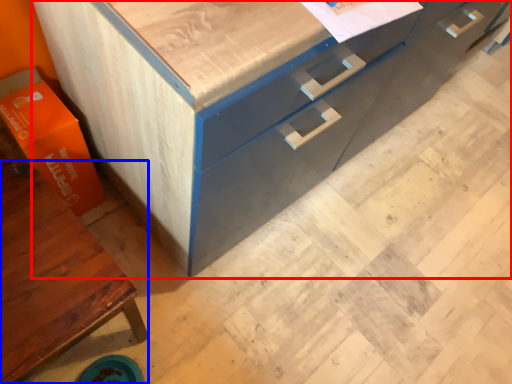
Question: Which object appears closest to the camera in this image, chest of drawers (highlighted by a red box) or cabinetry (highlighted by a blue box)?

Choices:
 (A) chest of drawers
 (B) cabinetry

Answer: (B)